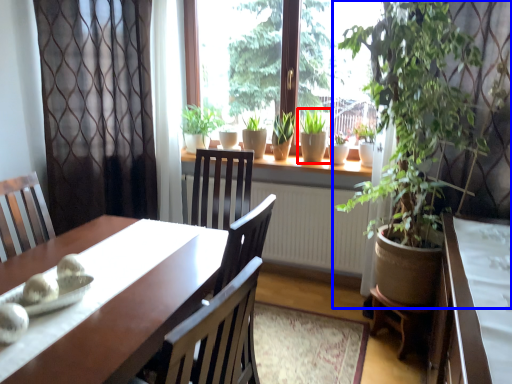
Question: Which object is closer to the camera taking this photo, houseplant (highlighted by a red box) or houseplant (highlighted by a blue box)?

Choices:
 (A) houseplant
 (B) houseplant

Answer: (B)